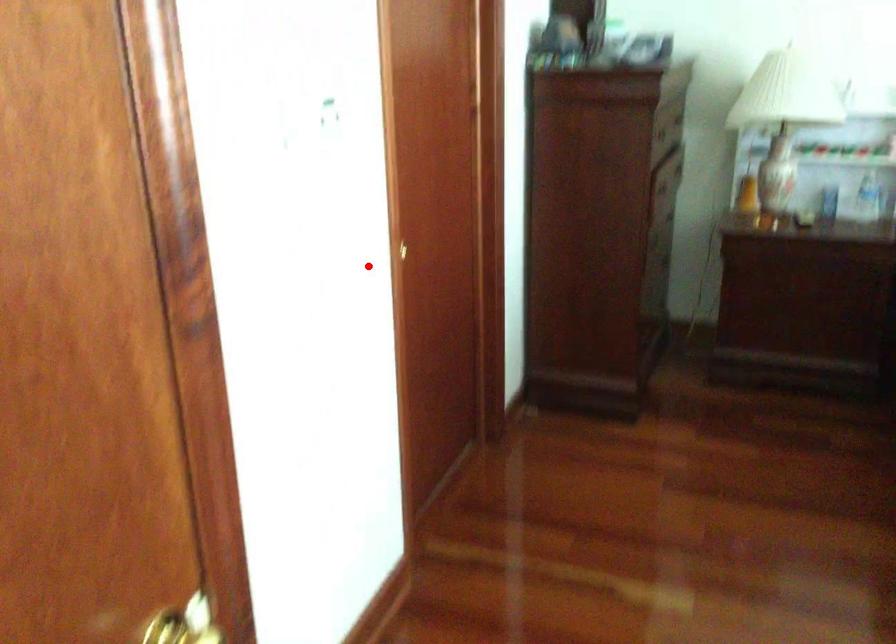
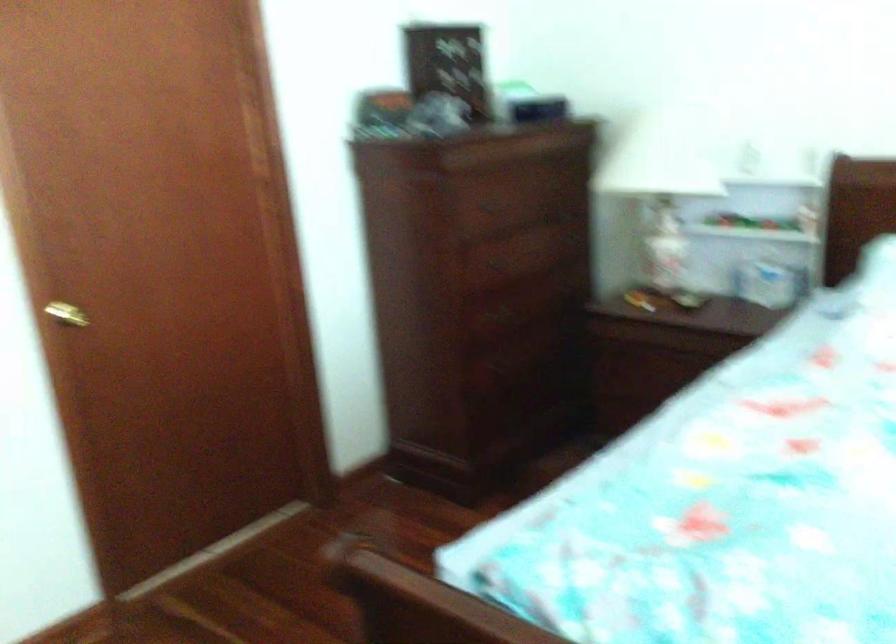
Where in the second image is the point corresponding to the highlighted location from the first image?

(66, 314)